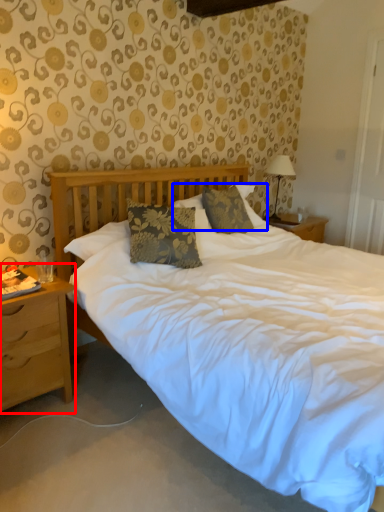
Question: Which point is further to the camera, nightstand (highlighted by a red box) or pillow (highlighted by a blue box)?

Choices:
 (A) nightstand
 (B) pillow

Answer: (B)